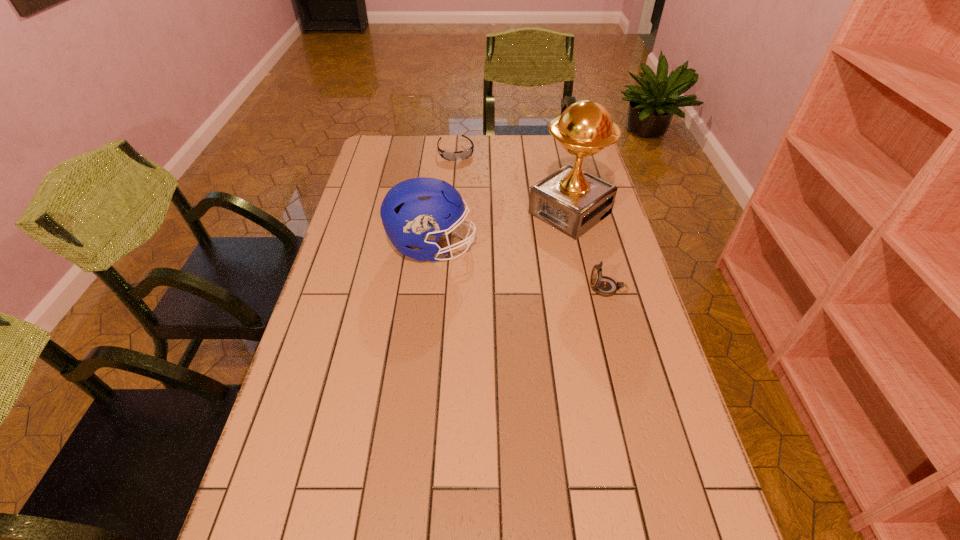
Find the location of a particular element. football helmet is located at coordinates (416, 212).

This screenshot has width=960, height=540. Find the location of `the third tallest object`. the third tallest object is located at coordinates point(605,286).

Identify the location of compass. This screenshot has width=960, height=540. (605, 286).

This screenshot has height=540, width=960. What are the coordinates of `the tallest object` in the screenshot? It's located at (571, 200).

The width and height of the screenshot is (960, 540). Identify the location of the farthest object. (450, 156).

Where is `the shortest object`? This screenshot has width=960, height=540. the shortest object is located at coordinates (450, 156).

At what (x,y) coordinates should I click in order to perform the action: click on vacant area situated 0.050m on the front-facing side of the third shortest object. Please return your answer as a coordinate pair (x, y). Looking at the image, I should click on (492, 247).

I want to click on vacant space located on the face of the nearest object, so click(x=495, y=288).

Identify the location of vacant area situated on the face of the nearest object. (454, 288).

Locate an element on the screen. The height and width of the screenshot is (540, 960). blank area located on the face of the nearest object is located at coordinates (537, 288).